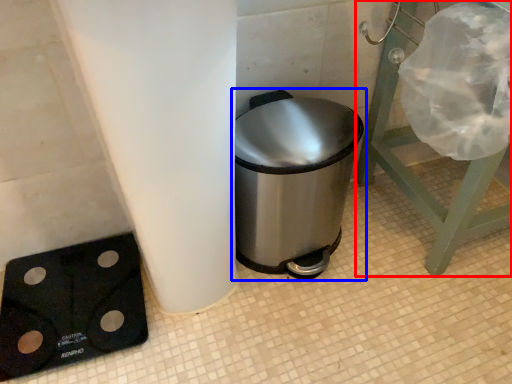
Question: Which object is further to the camera taking this photo, furniture (highlighted by a red box) or waste container (highlighted by a blue box)?

Choices:
 (A) furniture
 (B) waste container

Answer: (B)